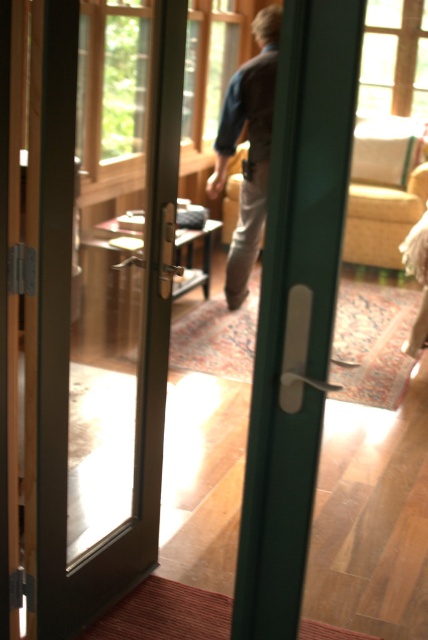
Question: Which object appears farthest from the camera in this image?

Choices:
 (A) matte glass door at center
 (B) khaki cotton pants at center

Answer: (B)

Question: Considering the relative positions of matte glass door at center and khaki cotton pants at center in the image provided, where is matte glass door at center located with respect to khaki cotton pants at center?

Choices:
 (A) above
 (B) below

Answer: (B)

Question: From the image, what is the correct spatial relationship of matte glass door at center in relation to khaki cotton pants at center?

Choices:
 (A) left
 (B) right

Answer: (A)

Question: In this image, where is matte glass door at center located relative to khaki cotton pants at center?

Choices:
 (A) left
 (B) right

Answer: (A)

Question: Which point is closer to the camera taking this photo?

Choices:
 (A) (240, 230)
 (B) (95, 129)

Answer: (B)